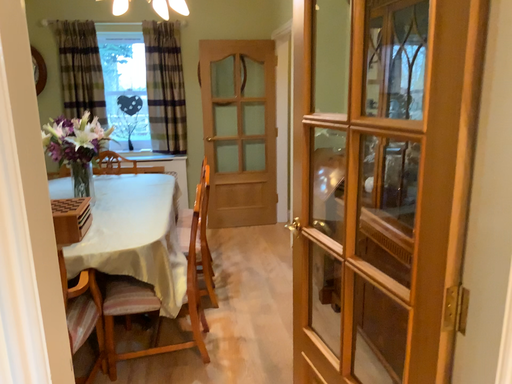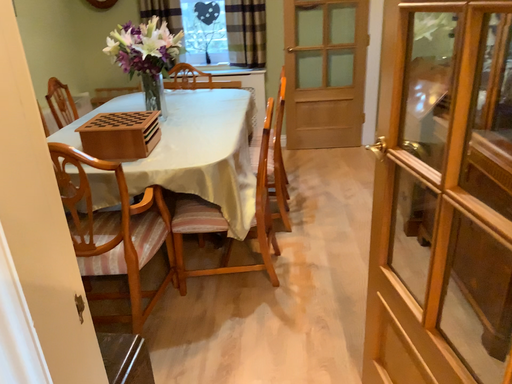
Question: Which way did the camera rotate in the video?

Choices:
 (A) rotated right
 (B) rotated left

Answer: (B)